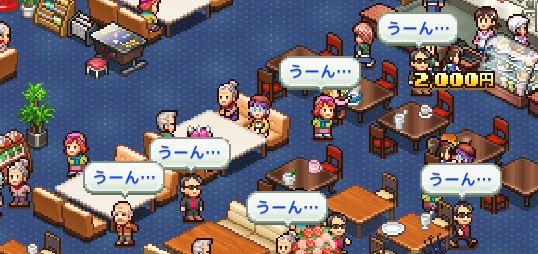
Locate an element on the screen. The image size is (538, 254). chairs is located at coordinates (260, 81).